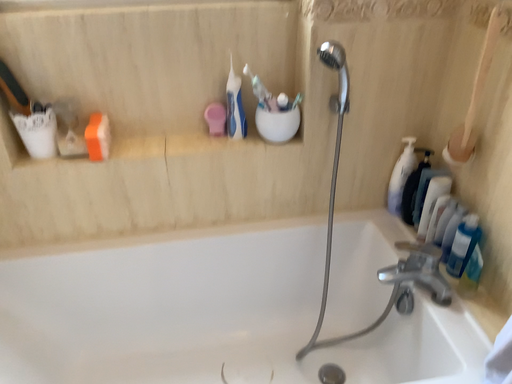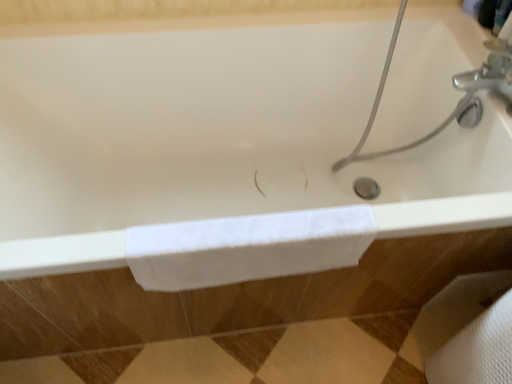
Question: Which way did the camera rotate in the video?

Choices:
 (A) rotated downward
 (B) rotated upward

Answer: (A)